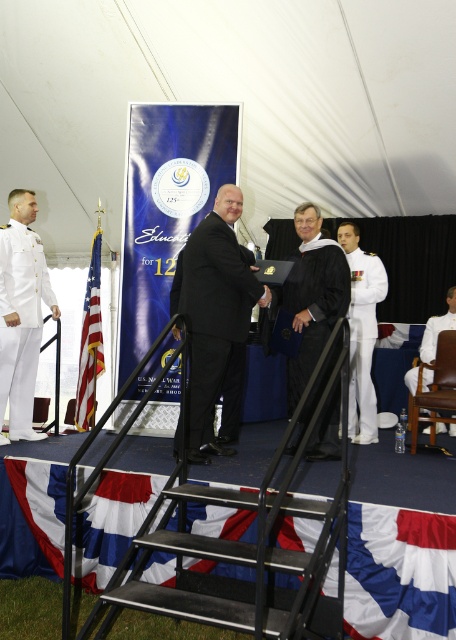
Question: Does white cotton pants at left have a smaller size compared to american flag at left?

Choices:
 (A) yes
 (B) no

Answer: (A)

Question: Is black metal/stainless steel ladder at center above american flag at left?

Choices:
 (A) no
 (B) yes

Answer: (A)

Question: Which object appears farthest from the camera in this image?

Choices:
 (A) white cotton uniform at center
 (B) american flag at left
 (C) black matte suit at center

Answer: (B)

Question: Can you confirm if red fabric flag at center is bigger than white cotton pants at left?

Choices:
 (A) no
 (B) yes

Answer: (B)

Question: Which object is closer to the camera taking this photo?

Choices:
 (A) black matte suit at center
 (B) white cotton pants at left
 (C) white cotton uniform at right
 (D) black metal/stainless steel ladder at center

Answer: (D)

Question: Which point is closer to the camera taking this photo?

Choices:
 (A) (88, 291)
 (B) (355, 273)
 (C) (283, 612)

Answer: (C)